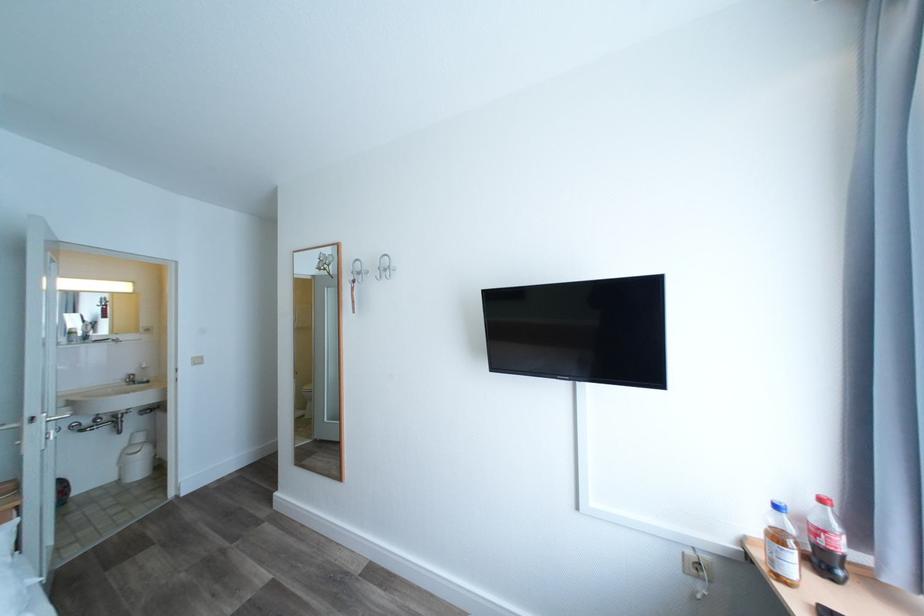
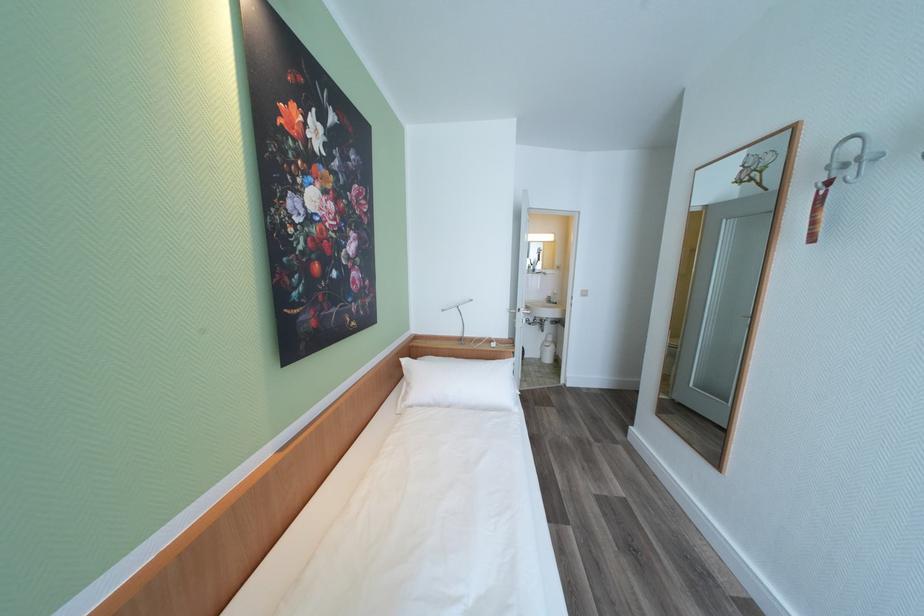
Question: The images are taken continuously from a first-person perspective. In which direction is your viewpoint rotating?

Choices:
 (A) Left
 (B) Right
 (C) Up
 (D) Down

Answer: (A)